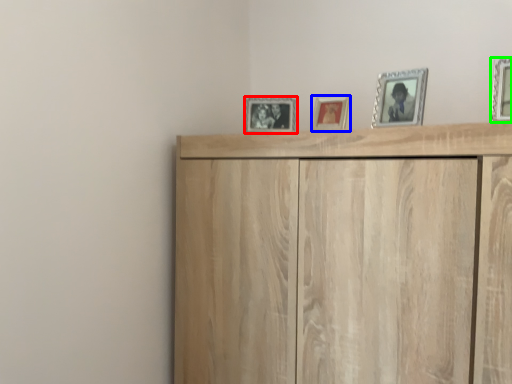
Question: Considering the real-world distances, which object is farthest from picture frame (highlighted by a red box)? picture frame (highlighted by a blue box) or picture frame (highlighted by a green box)?

Choices:
 (A) picture frame
 (B) picture frame

Answer: (B)